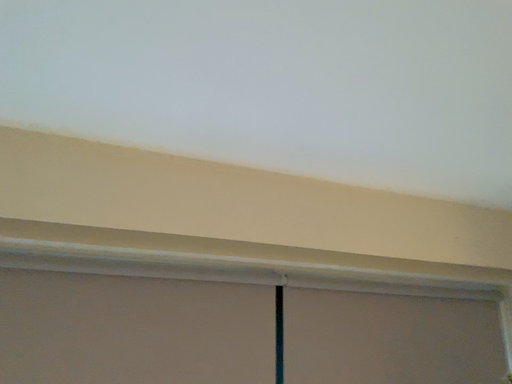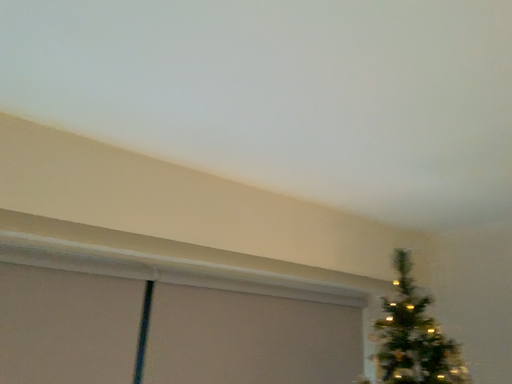
Question: Which way did the camera rotate in the video?

Choices:
 (A) rotated right
 (B) rotated left

Answer: (A)